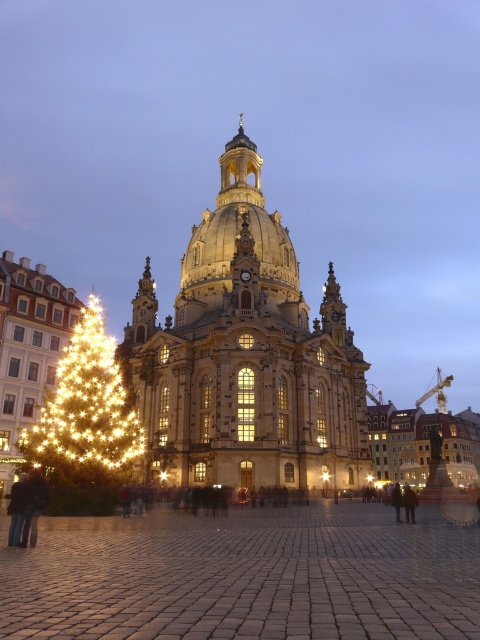
Question: Can you confirm if brown cobblestone at center is positioned below golden stone church at center?

Choices:
 (A) yes
 (B) no

Answer: (A)

Question: Does brown cobblestone at center lie behind illuminated gold christmas tree at left?

Choices:
 (A) no
 (B) yes

Answer: (A)

Question: Which object is positioned farthest from the brown cobblestone at center?

Choices:
 (A) illuminated gold christmas tree at left
 (B) golden stone church at center

Answer: (B)

Question: Among these points, which one is farthest from the camera?

Choices:
 (A) (84, 420)
 (B) (222, 436)

Answer: (B)

Question: Which point is closer to the camera?

Choices:
 (A) (34, 461)
 (B) (264, 259)

Answer: (A)

Question: Can you confirm if brown cobblestone at center is positioned to the right of golden stone church at center?

Choices:
 (A) yes
 (B) no

Answer: (A)